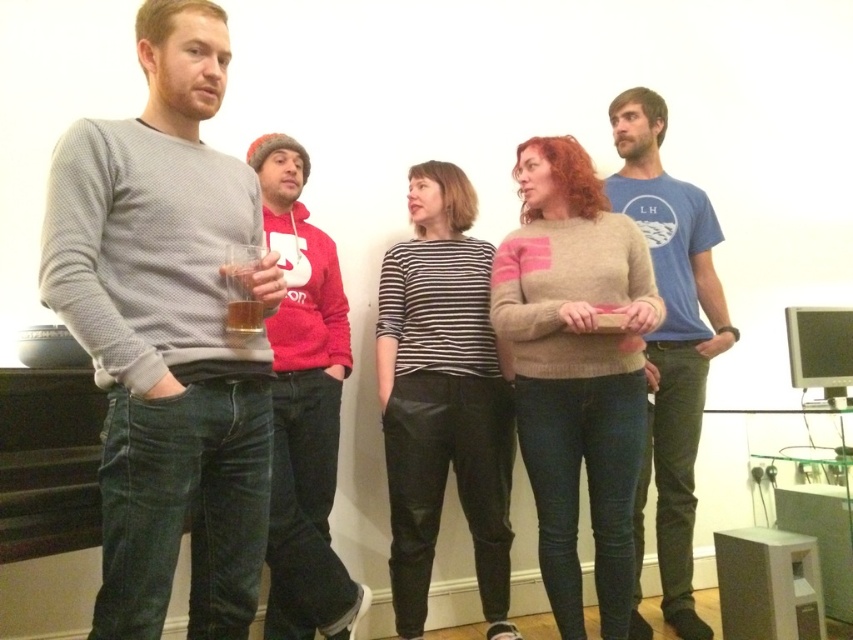
Describe the element at coordinates (442, 397) in the screenshot. I see `black striped shirt at center` at that location.

Which is above, black striped shirt at center or blue cotton t-shirt at center?

blue cotton t-shirt at center is above.

Is point (424, 339) positioned in front of point (659, 186)?

That is True.

Locate an element on the screen. black striped shirt at center is located at coordinates (442, 397).

Is matte red hoodie at center to the right of blue cotton t-shirt at center from the viewer's perspective?

In fact, matte red hoodie at center is to the left of blue cotton t-shirt at center.

Can you confirm if matte red hoodie at center is positioned to the left of blue cotton t-shirt at center?

Yes, matte red hoodie at center is to the left of blue cotton t-shirt at center.

The image size is (853, 640). What do you see at coordinates (303, 406) in the screenshot?
I see `matte red hoodie at center` at bounding box center [303, 406].

In order to click on matte red hoodie at center in this screenshot , I will do `click(303, 406)`.

Is black striped shirt at center smaller than matte red hoodie at center?

Correct, black striped shirt at center occupies less space than matte red hoodie at center.

Which is more to the left, black striped shirt at center or matte red hoodie at center?

matte red hoodie at center

Is point (440, 273) in front of point (292, 426)?

No, (440, 273) is behind (292, 426).

The image size is (853, 640). What are the coordinates of `black striped shirt at center` in the screenshot? It's located at (442, 397).